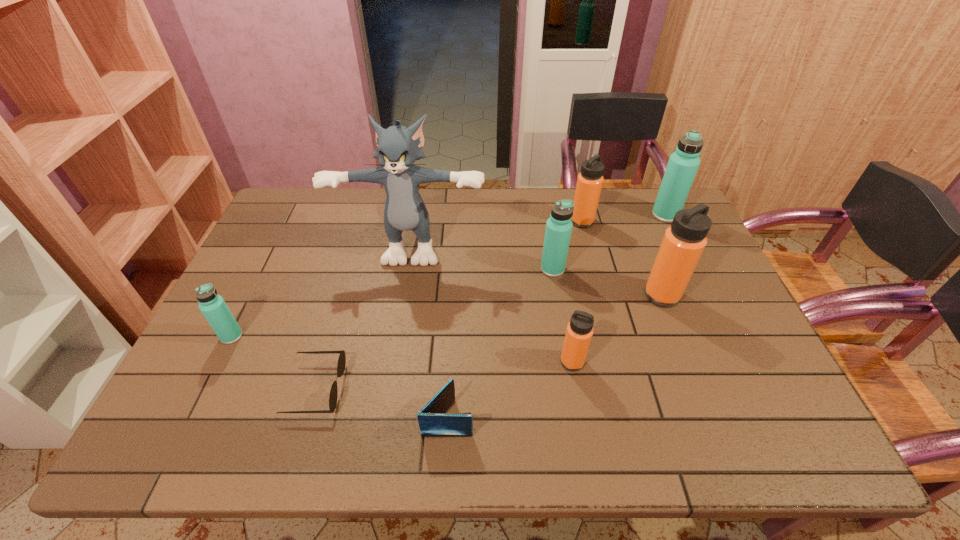
This screenshot has width=960, height=540. Find the location of `vacant space located on the left of the rightmost orange thermos bottle`. vacant space located on the left of the rightmost orange thermos bottle is located at coordinates (544, 295).

I want to click on free space located 0.350m on the front of the farthest orange thermos bottle, so click(606, 310).

You are a GUI agent. You are given a task and a screenshot of the screen. Output one action in this format:
    pyautogui.click(x=<x>, y=<y>)
    Task: Click on the vacant space located 0.140m on the left of the second aqua thermos bottle from left to right
    Image resolution: width=960 pixels, height=540 pixels.
    Given the screenshot: What is the action you would take?
    pyautogui.click(x=493, y=269)

What are the coordinates of `vacant space located 0.210m on the right of the leftmost thermos bottle` in the screenshot? It's located at (324, 336).

Where is `free space located on the back of the nearest thermos bottle`? free space located on the back of the nearest thermos bottle is located at coordinates (565, 321).

Locate an element on the screen. vacant space situated 0.260m on the exterior surface of the wallet is located at coordinates (590, 417).

Locate an element on the screen. This screenshot has height=540, width=960. free space located 0.300m on the front-facing side of the shortest object is located at coordinates (470, 388).

Identify the location of cat that is at the far edge. This screenshot has height=540, width=960. [405, 210].

Find the location of a particular element. The image size is (960, 540). wallet located in the near edge section of the desktop is located at coordinates (433, 422).

You are a GUI agent. You are given a task and a screenshot of the screen. Output one action in this format:
    pyautogui.click(x=<x>, y=<y>)
    Task: Click on the sunglasses located in the near edge section of the desktop
    The width and height of the screenshot is (960, 540).
    Given the screenshot: What is the action you would take?
    pyautogui.click(x=341, y=364)